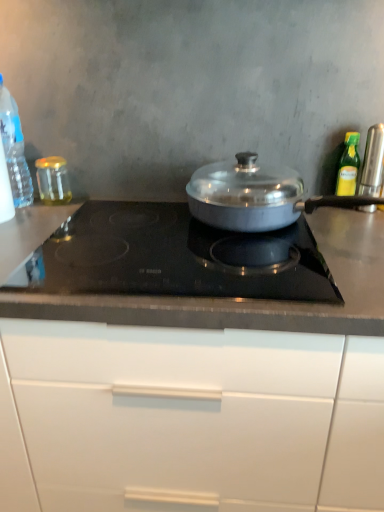
I want to click on translucent glass jar at left, marked as the second kitchen appliance in a left-to-right arrangement, so click(x=53, y=180).

The height and width of the screenshot is (512, 384). What do you see at coordinates (53, 180) in the screenshot?
I see `translucent glass jar at left, placed as the 4th kitchen appliance when sorted from right to left` at bounding box center [53, 180].

Where is `satin silver pan at center, which is the 3th kitchen appliance in left-to-right order`? This screenshot has height=512, width=384. satin silver pan at center, which is the 3th kitchen appliance in left-to-right order is located at coordinates (255, 196).

Are satin silver pan at center, the 3th kitchen appliance when ordered from right to left, and satin silver canister at right, which is the fifth kitchen appliance from left to right, beside each other?

No.

Consider the image. Is satin silver pan at center, the 3th kitchen appliance when ordered from right to left, further to camera compared to satin silver canister at right, which is the fifth kitchen appliance from left to right?

No.

Image resolution: width=384 pixels, height=512 pixels. I want to click on kitchen appliance that is the 1st object located behind the satin silver pan at center, the 3th kitchen appliance when ordered from right to left, so click(x=373, y=162).

Based on the photo, is satin silver canister at right, which ranks as the 1th kitchen appliance in right-to-left order, at the back of satin silver pan at center, the 3th kitchen appliance when ordered from right to left?

That's not correct — satin silver pan at center, the 3th kitchen appliance when ordered from right to left, is not looking away from satin silver canister at right, which ranks as the 1th kitchen appliance in right-to-left order.

Would you say translucent glass jar at left, placed as the 4th kitchen appliance when sorted from right to left, is to the left or to the right of white glossy cabinet at center in the picture?

Clearly, translucent glass jar at left, placed as the 4th kitchen appliance when sorted from right to left, is on the left of white glossy cabinet at center in the image.

Could you measure the distance between translucent glass jar at left, marked as the second kitchen appliance in a left-to-right arrangement, and white glossy cabinet at center?

translucent glass jar at left, marked as the second kitchen appliance in a left-to-right arrangement, and white glossy cabinet at center are 28.79 inches apart.

Is point (64, 191) positioned behind point (191, 454)?

Yes, it is behind point (191, 454).

Is translucent glass jar at left, placed as the 4th kitchen appliance when sorted from right to left, facing towards white glossy cabinet at center?

No.

How many degrees apart are the facing directions of white glossy cabinet at center and satin silver canister at right, which ranks as the 1th kitchen appliance in right-to-left order?

white glossy cabinet at center and satin silver canister at right, which ranks as the 1th kitchen appliance in right-to-left order, are facing 2.88 degrees away from each other.

Considering the relative positions of white glossy cabinet at center and satin silver canister at right, which ranks as the 1th kitchen appliance in right-to-left order, in the image provided, is white glossy cabinet at center in front of satin silver canister at right, which ranks as the 1th kitchen appliance in right-to-left order,?

That is True.

Identify the location of cabinetry below the satin silver canister at right, which ranks as the 1th kitchen appliance in right-to-left order (from the image's perspective). (193, 418).

Based on the photo, from the image's perspective, is satin silver canister at right, which is the fifth kitchen appliance from left to right, under green glass bottle at upper right, which is counted as the 2th kitchen appliance, starting from the right?

Indeed, from the image's perspective, satin silver canister at right, which is the fifth kitchen appliance from left to right, is shown beneath green glass bottle at upper right, which is counted as the 2th kitchen appliance, starting from the right.

Who is shorter, satin silver canister at right, which is the fifth kitchen appliance from left to right, or green glass bottle at upper right, which is counted as the 2th kitchen appliance, starting from the right?

Standing shorter between the two is green glass bottle at upper right, which is counted as the 2th kitchen appliance, starting from the right.

Identify the location of kitchen appliance that is the 1st object directly below the satin silver canister at right, which ranks as the 1th kitchen appliance in right-to-left order (from a real-world perspective). This screenshot has width=384, height=512. (348, 166).

From the picture: Considering their positions, is satin silver canister at right, which is the fifth kitchen appliance from left to right, located in front of or behind green glass bottle at upper right, the fourth kitchen appliance positioned from the left?

In the image, satin silver canister at right, which is the fifth kitchen appliance from left to right, appears in front of green glass bottle at upper right, the fourth kitchen appliance positioned from the left.

Which of these two, satin silver canister at right, which is the fifth kitchen appliance from left to right, or white glossy cabinet at center, is thinner?

satin silver canister at right, which is the fifth kitchen appliance from left to right, is thinner.

Who is smaller, satin silver canister at right, which ranks as the 1th kitchen appliance in right-to-left order, or white glossy cabinet at center?

satin silver canister at right, which ranks as the 1th kitchen appliance in right-to-left order, is smaller.

Could you tell me if satin silver canister at right, which is the fifth kitchen appliance from left to right, is facing white glossy cabinet at center?

No, satin silver canister at right, which is the fifth kitchen appliance from left to right, is not turned towards white glossy cabinet at center.

In the scene shown: Measure the distance from satin silver canister at right, which is the fifth kitchen appliance from left to right, to white glossy cabinet at center.

satin silver canister at right, which is the fifth kitchen appliance from left to right, and white glossy cabinet at center are 27.24 inches apart.

Does green glass bottle at upper right, the fourth kitchen appliance positioned from the left, appear on the left side of clear plastic bottle at left, the 1th kitchen appliance viewed from the left?

No, green glass bottle at upper right, the fourth kitchen appliance positioned from the left, is not to the left of clear plastic bottle at left, the 1th kitchen appliance viewed from the left.

Considering the positions of objects green glass bottle at upper right, the fourth kitchen appliance positioned from the left, and clear plastic bottle at left, the fifth kitchen appliance from the right, in the image provided, who is in front, green glass bottle at upper right, the fourth kitchen appliance positioned from the left, or clear plastic bottle at left, the fifth kitchen appliance from the right,?

clear plastic bottle at left, the fifth kitchen appliance from the right, is closer to the camera.

Is green glass bottle at upper right, which is counted as the 2th kitchen appliance, starting from the right, inside the boundaries of clear plastic bottle at left, the fifth kitchen appliance from the right, or outside?

green glass bottle at upper right, which is counted as the 2th kitchen appliance, starting from the right, exists outside the volume of clear plastic bottle at left, the fifth kitchen appliance from the right.

Based on their sizes in the image, would you say green glass bottle at upper right, the fourth kitchen appliance positioned from the left, is bigger or smaller than clear plastic bottle at left, the fifth kitchen appliance from the right?

green glass bottle at upper right, the fourth kitchen appliance positioned from the left, is smaller than clear plastic bottle at left, the fifth kitchen appliance from the right.

Can you confirm if green glass bottle at upper right, the fourth kitchen appliance positioned from the left, is thinner than white glossy cabinet at center?

Correct, the width of green glass bottle at upper right, the fourth kitchen appliance positioned from the left, is less than that of white glossy cabinet at center.

From the image's perspective, who appears lower, green glass bottle at upper right, the fourth kitchen appliance positioned from the left, or white glossy cabinet at center?

white glossy cabinet at center appears lower in the image.

Which of these two, green glass bottle at upper right, which is counted as the 2th kitchen appliance, starting from the right, or white glossy cabinet at center, is bigger?

Bigger between the two is white glossy cabinet at center.

Is green glass bottle at upper right, the fourth kitchen appliance positioned from the left, taller or shorter than white glossy cabinet at center?

Clearly, green glass bottle at upper right, the fourth kitchen appliance positioned from the left, is shorter compared to white glossy cabinet at center.

Find the location of a particular element. This screenshot has height=512, width=384. the 2nd kitchen appliance to the right of the satin silver pan at center, the 3th kitchen appliance when ordered from right to left, counting from the anchor's position is located at coordinates (373, 162).

I want to click on the 1st kitchen appliance counting from the left of the white glossy cabinet at center, so click(x=53, y=180).

Estimate the real-world distances between objects in this image. Which object is further from green glass bottle at upper right, which is counted as the 2th kitchen appliance, starting from the right, satin silver canister at right, which is the fifth kitchen appliance from left to right, or satin silver pan at center, the 3th kitchen appliance when ordered from right to left?

satin silver pan at center, the 3th kitchen appliance when ordered from right to left, lies further to green glass bottle at upper right, which is counted as the 2th kitchen appliance, starting from the right, than the other object.

From the image, which object appears to be farther from green glass bottle at upper right, the fourth kitchen appliance positioned from the left, white glossy cabinet at center or satin silver canister at right, which is the fifth kitchen appliance from left to right?

white glossy cabinet at center is further to green glass bottle at upper right, the fourth kitchen appliance positioned from the left.

Which object lies nearer to the anchor point clear plastic bottle at left, the fifth kitchen appliance from the right, green glass bottle at upper right, the fourth kitchen appliance positioned from the left, or black glass cooktop at center?

black glass cooktop at center lies closer to clear plastic bottle at left, the fifth kitchen appliance from the right, than the other object.

Which object lies nearer to the anchor point satin silver pan at center, the 3th kitchen appliance when ordered from right to left, white glossy cabinet at center or green glass bottle at upper right, which is counted as the 2th kitchen appliance, starting from the right?

Among the two, green glass bottle at upper right, which is counted as the 2th kitchen appliance, starting from the right, is located nearer to satin silver pan at center, the 3th kitchen appliance when ordered from right to left.

When comparing their distances from white glossy cabinet at center, does green glass bottle at upper right, the fourth kitchen appliance positioned from the left, or black glass cooktop at center seem further?

Based on the image, green glass bottle at upper right, the fourth kitchen appliance positioned from the left, appears to be further to white glossy cabinet at center.

Which object lies nearer to the anchor point satin silver pan at center, the 3th kitchen appliance when ordered from right to left, green glass bottle at upper right, the fourth kitchen appliance positioned from the left, or clear plastic bottle at left, the fifth kitchen appliance from the right?

green glass bottle at upper right, the fourth kitchen appliance positioned from the left, is positioned closer to the anchor satin silver pan at center, the 3th kitchen appliance when ordered from right to left.

Looking at the image, which one is located closer to green glass bottle at upper right, which is counted as the 2th kitchen appliance, starting from the right, satin silver canister at right, which is the fifth kitchen appliance from left to right, or clear plastic bottle at left, the 1th kitchen appliance viewed from the left?

Based on the image, satin silver canister at right, which is the fifth kitchen appliance from left to right, appears to be nearer to green glass bottle at upper right, which is counted as the 2th kitchen appliance, starting from the right.

From the image, which object appears to be nearer to satin silver pan at center, which is the 3th kitchen appliance in left-to-right order, black glass cooktop at center or green glass bottle at upper right, which is counted as the 2th kitchen appliance, starting from the right?

The object closer to satin silver pan at center, which is the 3th kitchen appliance in left-to-right order, is black glass cooktop at center.

This screenshot has width=384, height=512. I want to click on cabinetry between clear plastic bottle at left, the fifth kitchen appliance from the right, and green glass bottle at upper right, which is counted as the 2th kitchen appliance, starting from the right, in the horizontal direction, so [193, 418].

The image size is (384, 512). I want to click on countertop that lies between clear plastic bottle at left, the 1th kitchen appliance viewed from the left, and white glossy cabinet at center from top to bottom, so click(249, 300).

This screenshot has height=512, width=384. Find the location of `countertop between clear plastic bottle at left, the 1th kitchen appliance viewed from the left, and satin silver pan at center, the 3th kitchen appliance when ordered from right to left`. countertop between clear plastic bottle at left, the 1th kitchen appliance viewed from the left, and satin silver pan at center, the 3th kitchen appliance when ordered from right to left is located at coordinates (249, 300).

Where is `countertop located between clear plastic bottle at left, the 1th kitchen appliance viewed from the left, and green glass bottle at upper right, the fourth kitchen appliance positioned from the left, in the left-right direction`? countertop located between clear plastic bottle at left, the 1th kitchen appliance viewed from the left, and green glass bottle at upper right, the fourth kitchen appliance positioned from the left, in the left-right direction is located at coordinates (249, 300).